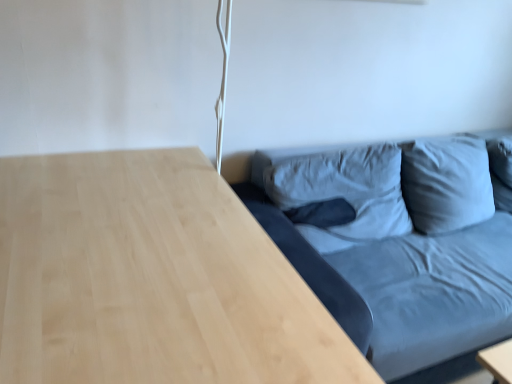
Question: Is light wood table at lower right not inside matte blue fabric couch at right?

Choices:
 (A) no
 (B) yes

Answer: (B)

Question: Is light wood table at lower right to the left of matte blue fabric couch at right from the viewer's perspective?

Choices:
 (A) yes
 (B) no

Answer: (A)

Question: From a real-world perspective, is light wood table at lower right positioned under matte blue fabric couch at right based on gravity?

Choices:
 (A) yes
 (B) no

Answer: (A)

Question: Does light wood table at lower right have a lesser width compared to matte blue fabric couch at right?

Choices:
 (A) yes
 (B) no

Answer: (A)

Question: From the image's perspective, is light wood table at lower right located above matte blue fabric couch at right?

Choices:
 (A) yes
 (B) no

Answer: (B)

Question: Can you confirm if light wood table at lower right is taller than matte blue fabric couch at right?

Choices:
 (A) yes
 (B) no

Answer: (B)

Question: Does matte blue fabric couch at right turn towards light wood table at lower right?

Choices:
 (A) yes
 (B) no

Answer: (B)

Question: Is the position of matte blue fabric couch at right more distant than that of light wood table at lower right?

Choices:
 (A) yes
 (B) no

Answer: (A)

Question: From a real-world perspective, is matte blue fabric couch at right positioned over light wood table at lower right based on gravity?

Choices:
 (A) yes
 (B) no

Answer: (A)

Question: Would you say matte blue fabric couch at right is outside light wood table at lower right?

Choices:
 (A) yes
 (B) no

Answer: (A)

Question: Can you confirm if matte blue fabric couch at right is shorter than light wood table at lower right?

Choices:
 (A) no
 (B) yes

Answer: (A)

Question: Can you confirm if matte blue fabric couch at right is taller than light wood table at lower right?

Choices:
 (A) yes
 (B) no

Answer: (A)

Question: From the image's perspective, is light wood table at lower right located above or below matte blue fabric couch at right?

Choices:
 (A) above
 (B) below

Answer: (B)